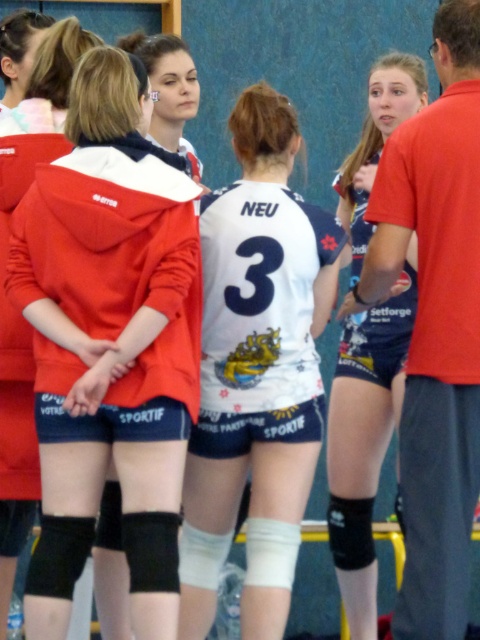
Question: Which of the following is the closest to the observer?

Choices:
 (A) matte red hoodie at center
 (B) white jersey at center

Answer: (A)

Question: Can you confirm if matte red hoodie at center is smaller than blue jersey shorts at center?

Choices:
 (A) yes
 (B) no

Answer: (B)

Question: Which object is farther from the camera taking this photo?

Choices:
 (A) matte red hoodie at center
 (B) blue jersey shorts at center

Answer: (B)

Question: Is matte red hoodie at center smaller than white jersey at center?

Choices:
 (A) yes
 (B) no

Answer: (B)

Question: From the image, what is the correct spatial relationship of matte red hoodie at center in relation to blue jersey shorts at center?

Choices:
 (A) right
 (B) left

Answer: (B)

Question: Which object is the closest to the white jersey at center?

Choices:
 (A) matte red hoodie at center
 (B) blue jersey shorts at center

Answer: (A)